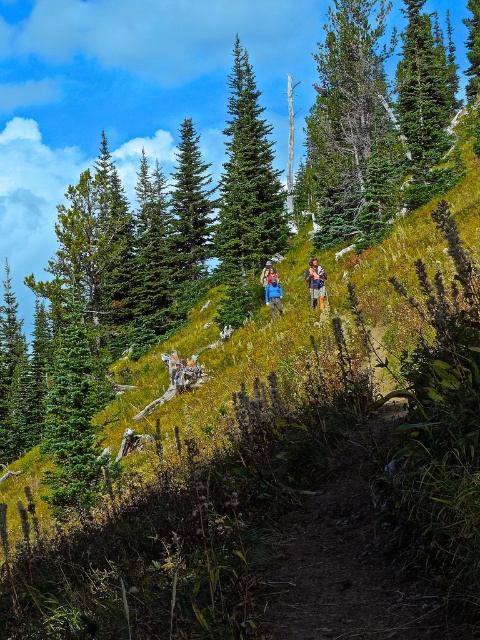
Question: Which is farther from the camouflage fabric backpack at center?

Choices:
 (A) green textured tree at upper center
 (B) green textured pine tree at center

Answer: (A)

Question: Is green textured tree at upper center wider than camouflage fabric backpack at center?

Choices:
 (A) yes
 (B) no

Answer: (A)

Question: Observing the image, what is the correct spatial positioning of green textured pine tree at center in reference to blue fabric jacket at center?

Choices:
 (A) below
 (B) above

Answer: (B)

Question: Considering the real-world distances, which object is farthest from the green textured pine tree at center?

Choices:
 (A) camouflage fabric backpack at center
 (B) green textured tree at upper center

Answer: (A)

Question: Which of the following is the farthest from the observer?

Choices:
 (A) (311, 122)
 (B) (282, 292)

Answer: (A)

Question: In this image, where is green textured pine tree at center located relative to camouflage fabric backpack at center?

Choices:
 (A) right
 (B) left

Answer: (B)